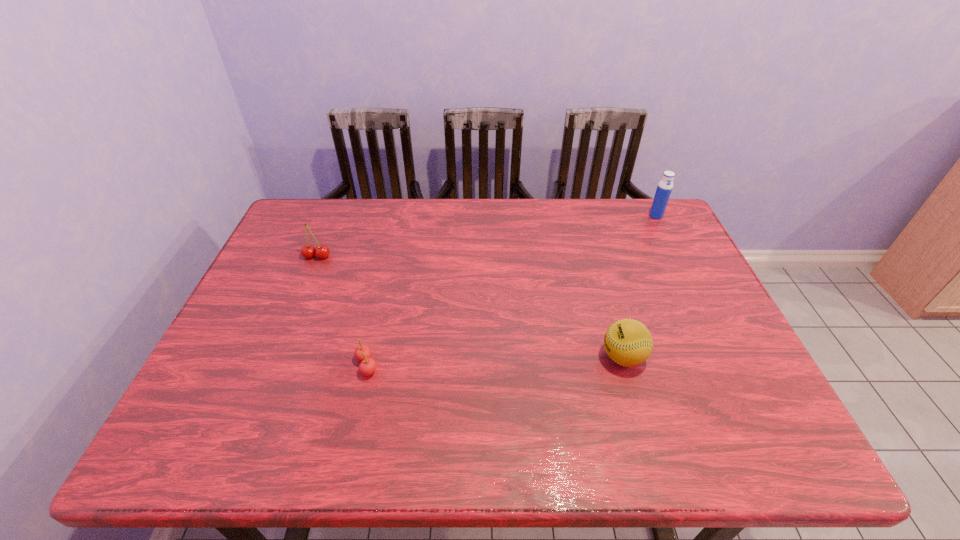
Locate an element on the screen. This screenshot has height=540, width=960. vacant space situated 0.070m on the logo side of the second object from right to left is located at coordinates (571, 357).

At what (x,y) coordinates should I click in order to perform the action: click on vacant area located 0.360m on the logo side of the second object from right to left. Please return your answer as a coordinate pair (x, y). Looking at the image, I should click on (450, 357).

This screenshot has width=960, height=540. I want to click on free space located 0.210m on the right of the shortest object, so click(468, 366).

You are a GUI agent. You are given a task and a screenshot of the screen. Output one action in this format:
    pyautogui.click(x=<x>, y=<y>)
    Task: Click on the object situated at the far edge
    This screenshot has width=960, height=540.
    Given the screenshot: What is the action you would take?
    pyautogui.click(x=664, y=188)

Identify the location of object situated at the left edge. This screenshot has width=960, height=540. (308, 251).

Find the location of `object that is at the right edge`. object that is at the right edge is located at coordinates (664, 188).

The width and height of the screenshot is (960, 540). In order to click on object that is at the far right corner in this screenshot , I will do `click(664, 188)`.

In the image, there is a desktop. Where is `free space at the far edge`? The width and height of the screenshot is (960, 540). free space at the far edge is located at coordinates (409, 239).

In order to click on vacant region at the near edge of the desktop in this screenshot , I will do `click(586, 456)`.

The image size is (960, 540). I want to click on free space at the left edge, so click(276, 300).